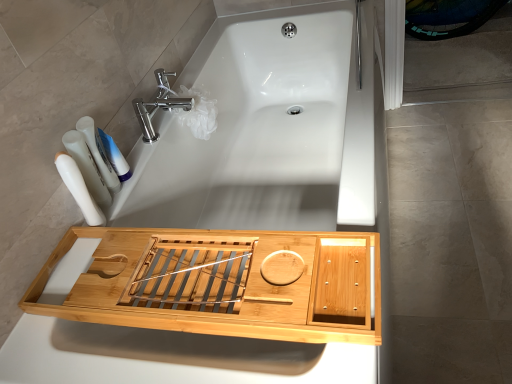
Question: Is there a large distance between white plastic bottles at left, placed as the first toiletry when sorted from back to front, and white matte toothpaste at upper left?

Choices:
 (A) yes
 (B) no

Answer: (B)

Question: From the image's perspective, does white plastic bottles at left, marked as the third toiletry in a front-to-back arrangement, appear higher than white matte toothpaste at upper left?

Choices:
 (A) no
 (B) yes

Answer: (A)

Question: Does white plastic bottles at left, placed as the first toiletry when sorted from back to front, have a greater height compared to white matte toothpaste at upper left?

Choices:
 (A) no
 (B) yes

Answer: (B)

Question: Does white plastic bottles at left, placed as the first toiletry when sorted from back to front, have a lesser height compared to white matte toothpaste at upper left?

Choices:
 (A) no
 (B) yes

Answer: (A)

Question: From a real-world perspective, does white plastic bottles at left, placed as the first toiletry when sorted from back to front, stand above white matte toothpaste at upper left?

Choices:
 (A) yes
 (B) no

Answer: (A)

Question: Considering the relative sizes of white plastic bottles at left, placed as the first toiletry when sorted from back to front, and white matte toothpaste at upper left in the image provided, is white plastic bottles at left, placed as the first toiletry when sorted from back to front, bigger than white matte toothpaste at upper left?

Choices:
 (A) yes
 (B) no

Answer: (A)

Question: Does white plastic toothbrushes at left, which is counted as the second toiletry, starting from the front, have a lesser height compared to white plastic bottles at left, which ranks as the 1th toiletry in front-to-back order?

Choices:
 (A) yes
 (B) no

Answer: (A)

Question: From a real-world perspective, is white plastic toothbrushes at left, which is counted as the second toiletry, starting from the front, physically above white plastic bottles at left, which appears as the 3th toiletry when viewed from the back?

Choices:
 (A) no
 (B) yes

Answer: (A)

Question: Is white plastic toothbrushes at left, which is counted as the second toiletry, starting from the front, positioned before white plastic bottles at left, which ranks as the 1th toiletry in front-to-back order?

Choices:
 (A) yes
 (B) no

Answer: (B)

Question: Is white plastic toothbrushes at left, which appears as the second toiletry when viewed from the back, looking in the opposite direction of white plastic bottles at left, which ranks as the 1th toiletry in front-to-back order?

Choices:
 (A) yes
 (B) no

Answer: (B)

Question: Is white plastic bottles at left, which ranks as the 1th toiletry in front-to-back order, a part of white plastic toothbrushes at left, which is counted as the second toiletry, starting from the front?

Choices:
 (A) no
 (B) yes

Answer: (A)

Question: Is white plastic toothbrushes at left, which appears as the second toiletry when viewed from the back, further to camera compared to white plastic bottles at left, which appears as the 3th toiletry when viewed from the back?

Choices:
 (A) no
 (B) yes

Answer: (B)

Question: Can you confirm if white plastic bottles at left, placed as the first toiletry when sorted from back to front, is taller than polished chrome faucet at upper center?

Choices:
 (A) no
 (B) yes

Answer: (B)